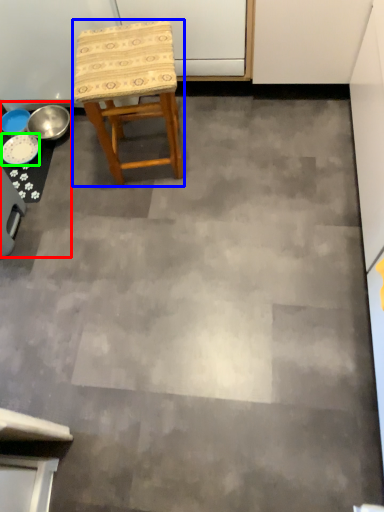
Question: Considering the real-world distances, which object is farthest from table (highlighted by a red box)? stool (highlighted by a blue box) or plate (highlighted by a green box)?

Choices:
 (A) stool
 (B) plate

Answer: (A)